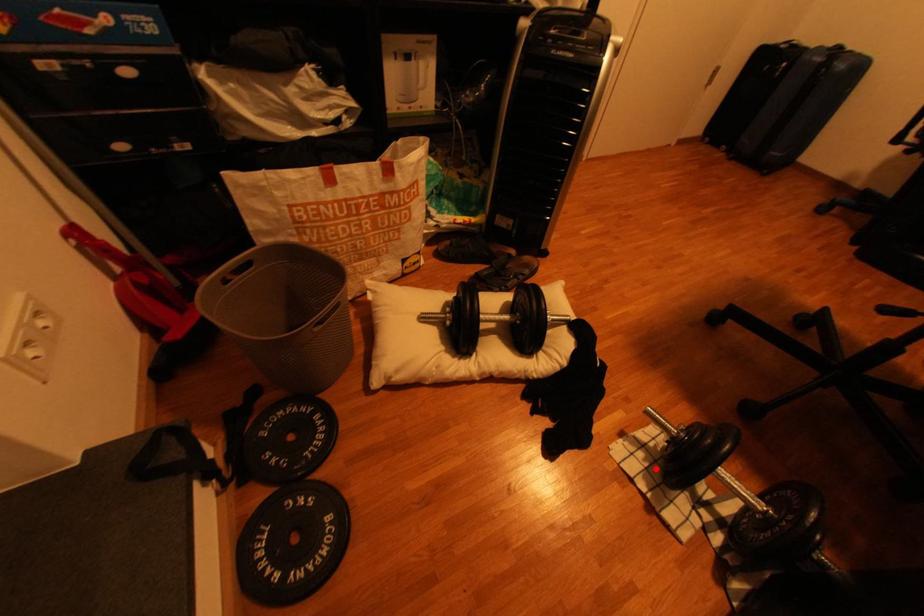
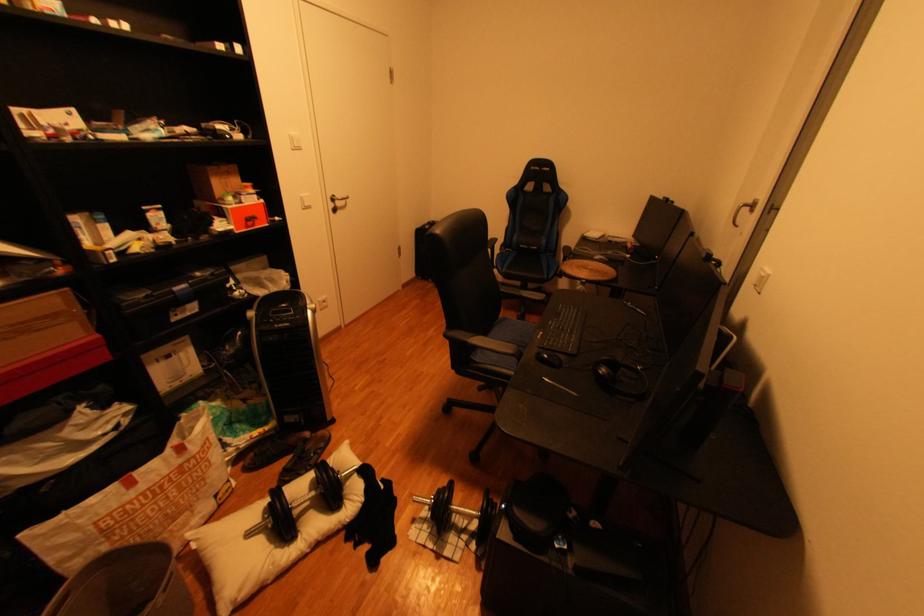
Question: I am providing you with two images of the same scene from different viewpoints. Image1 has a red point marked. In image2, the corresponding 3D location appears at what relative position? Reply with the corresponding letter.

Choices:
 (A) Closer
 (B) Farther

Answer: (B)